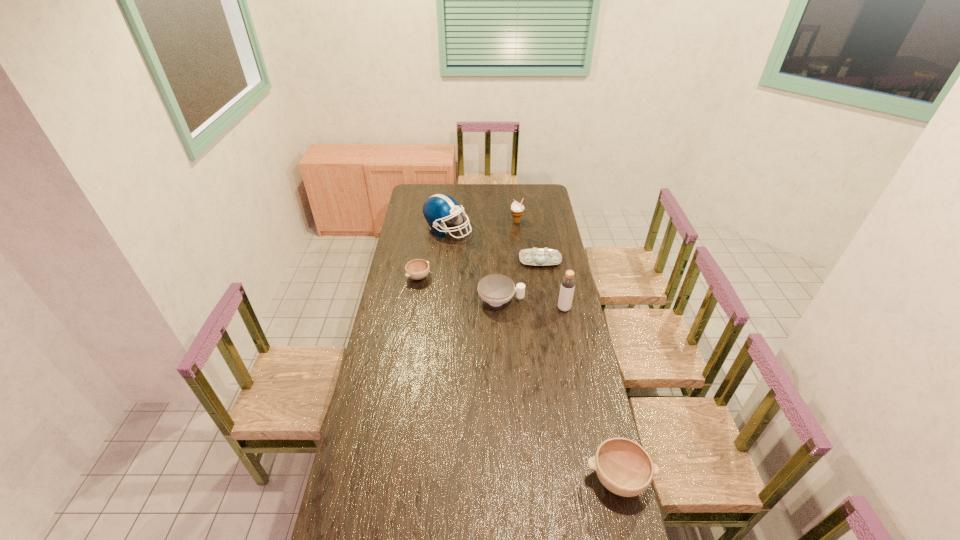
Find the location of `the fourth nearest object`. the fourth nearest object is located at coordinates (417, 269).

The height and width of the screenshot is (540, 960). I want to click on the shortest object, so click(417, 269).

Locate an element on the screen. the taller bowl is located at coordinates (623, 466).

The image size is (960, 540). Identify the location of the nearest object. (623, 466).

The image size is (960, 540). I want to click on icecream, so click(x=517, y=209).

Locate an element on the screen. Image resolution: width=960 pixels, height=540 pixels. football helmet is located at coordinates (438, 208).

The width and height of the screenshot is (960, 540). In order to click on the fifth nearest object in this screenshot , I will do `click(536, 256)`.

This screenshot has height=540, width=960. What are the coordinates of `the nearer chinaware` in the screenshot? It's located at (496, 289).

Identify the location of bottle. (568, 281).

Locate an element on the screen. free space located on the right of the fourth nearest object is located at coordinates (477, 277).